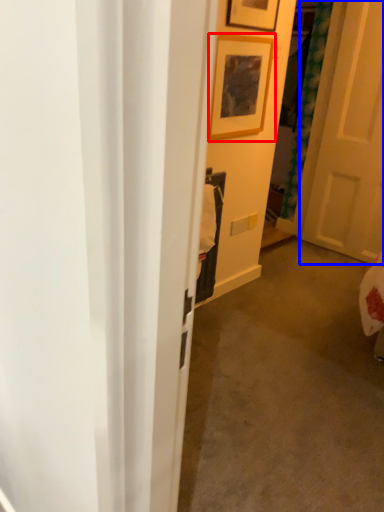
Question: Among these objects, which one is nearest to the camera, picture frame (highlighted by a red box) or door (highlighted by a blue box)?

Choices:
 (A) picture frame
 (B) door

Answer: (A)